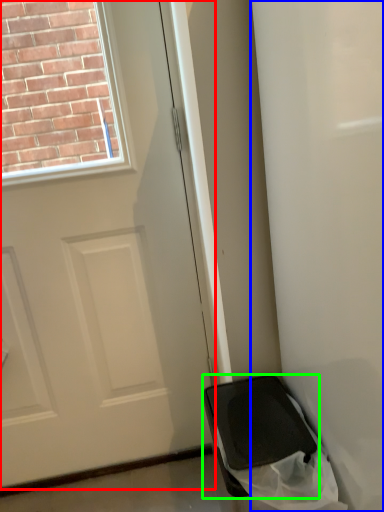
Question: Estimate the real-world distances between objects in this image. Which object is farther from door (highlighted by a red box), screen door (highlighted by a blue box) or furniture (highlighted by a green box)?

Choices:
 (A) screen door
 (B) furniture

Answer: (A)